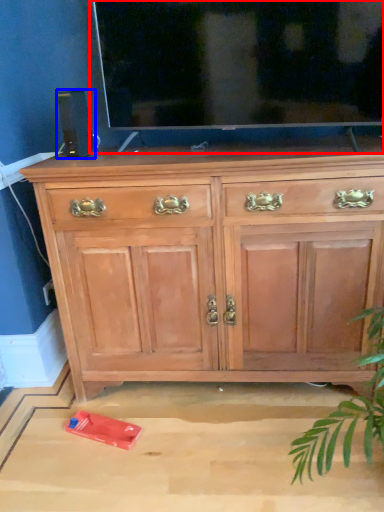
Question: Which point is further to the camera, glass door (highlighted by a red box) or speaker (highlighted by a blue box)?

Choices:
 (A) glass door
 (B) speaker

Answer: (B)